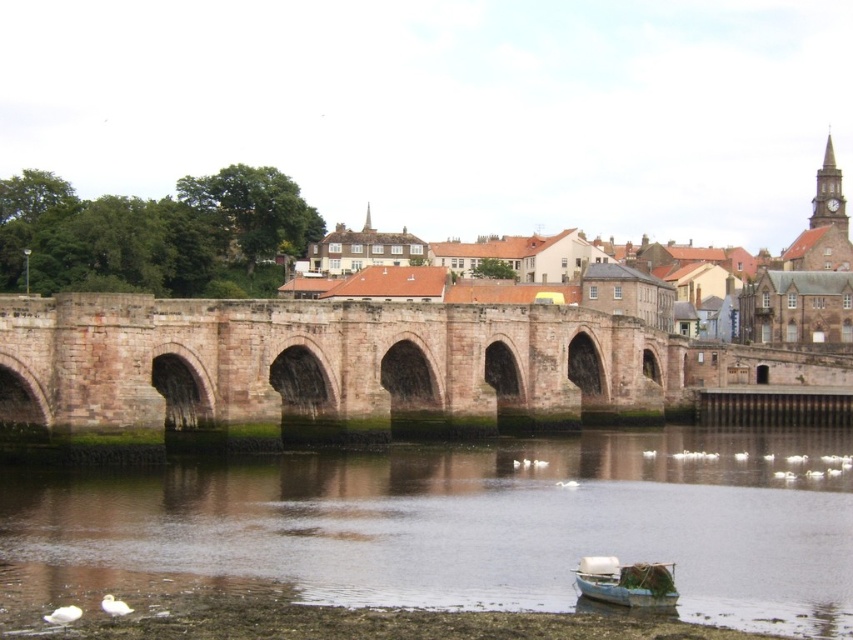
The height and width of the screenshot is (640, 853). What do you see at coordinates (460, 524) in the screenshot?
I see `brown stone river at lower center` at bounding box center [460, 524].

Does point (662, 456) lie in front of point (749, 289)?

Yes, it is in front of point (749, 289).

Locate an element on the screen. This screenshot has width=853, height=640. brown stone river at lower center is located at coordinates (460, 524).

This screenshot has width=853, height=640. Find the location of `brown stone river at lower center`. brown stone river at lower center is located at coordinates (460, 524).

Can you confirm if brown stone bridge at center is positioned above white wooden boat at lower center?

Yes, brown stone bridge at center is above white wooden boat at lower center.

How much distance is there between brown stone bridge at center and white wooden boat at lower center?

330.60 feet

Is point (320, 282) positioned behind point (604, 600)?

Yes, it is.

The width and height of the screenshot is (853, 640). I want to click on brown stone bridge at center, so click(640, 276).

Between rustic stone bridge at center and brown stone bridge at center, which one appears on the left side from the viewer's perspective?

rustic stone bridge at center is more to the left.

Which is behind, point (596, 330) or point (791, 310)?

Positioned behind is point (791, 310).

Is point (136, 358) closer to camera compared to point (804, 264)?

Yes, point (136, 358) is closer to viewer.

Find the location of a particular element. rustic stone bridge at center is located at coordinates (320, 369).